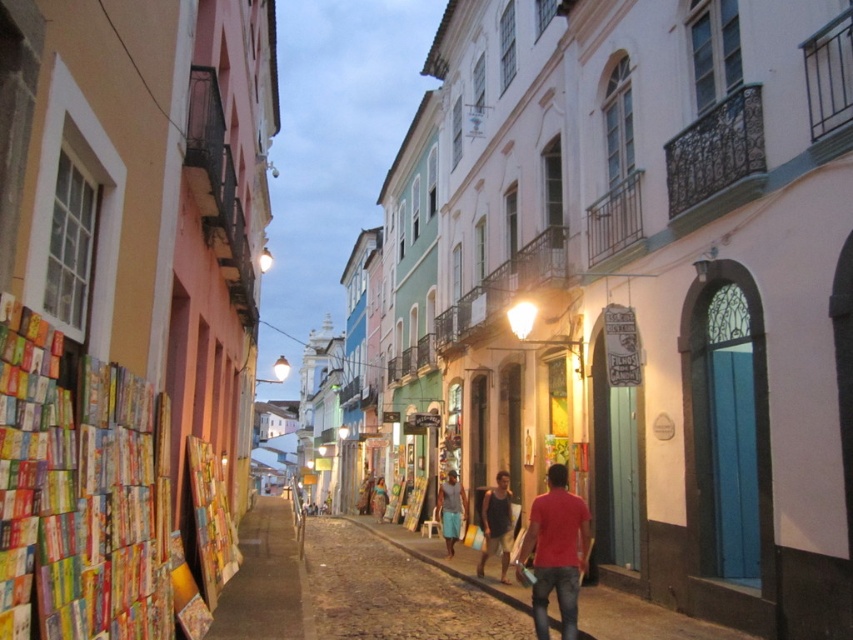
Does matte red t-shirt at center have a lesser width compared to matte gray tank top at center?

Incorrect, matte red t-shirt at center's width is not less than matte gray tank top at center's.

Find the location of a particular element. Image resolution: width=853 pixels, height=640 pixels. matte red t-shirt at center is located at coordinates (555, 552).

Between point (456, 484) and point (381, 499), which one is positioned in front?

Positioned in front is point (456, 484).

Does point (444, 515) come farther from viewer compared to point (380, 499)?

That is False.

Identify the location of gray fabric shorts at center. (450, 509).

Is point (544, 506) behind point (454, 538)?

No, it is not.

Where is `matte red t-shirt at center`? This screenshot has height=640, width=853. matte red t-shirt at center is located at coordinates (555, 552).

Find the location of a particular element. matte red t-shirt at center is located at coordinates (555, 552).